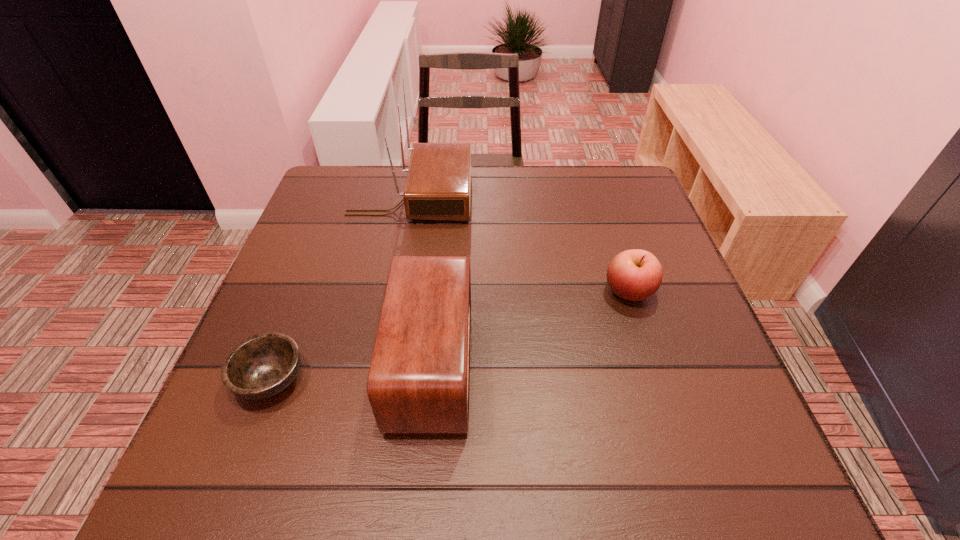
You are a GUI agent. You are given a task and a screenshot of the screen. Output one action in this format:
    pyautogui.click(x=<x>, y=<y>)
    Task: Click on the vacant area at the right edge of the desktop
    
    Given the screenshot: What is the action you would take?
    pyautogui.click(x=664, y=266)

The image size is (960, 540). I want to click on vacant area at the far left corner of the desktop, so click(x=355, y=178).

The height and width of the screenshot is (540, 960). I want to click on free space between the second tallest object and the bowl, so click(x=351, y=372).

Image resolution: width=960 pixels, height=540 pixels. I want to click on vacant space that's between the second shortest object and the shorter radio receiver, so click(x=530, y=328).

Image resolution: width=960 pixels, height=540 pixels. Find the location of `blank region between the shortest object and the farther radio receiver`. blank region between the shortest object and the farther radio receiver is located at coordinates (341, 288).

You are a GUI agent. You are given a task and a screenshot of the screen. Output one action in this format:
    pyautogui.click(x=<x>, y=<y>)
    Task: Click on the unoccupied position between the third shortest object and the apple
    This screenshot has width=960, height=540.
    Given the screenshot: What is the action you would take?
    pyautogui.click(x=530, y=328)

At what (x,y) coordinates should I click in order to perform the action: click on free space between the farther radio receiver and the shortest object. Please return your answer as a coordinate pair (x, y). The height and width of the screenshot is (540, 960). Looking at the image, I should click on (341, 288).

Identify the location of object that is the second closest to the shortest object. The image size is (960, 540). (438, 183).

This screenshot has width=960, height=540. In order to click on the third closest object to the apple in this screenshot , I will do (262, 366).

Identify the location of blank space that satisfies the following two spatial constraints: 1. on the back side of the second shortest object; 2. on the front panel of the taller radio receiver. This screenshot has width=960, height=540. (598, 197).